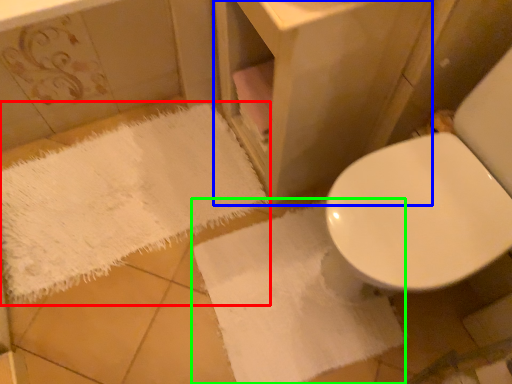
Question: Considering the real-world distances, which object is farthest from bath towel (highlighted by a red box)? vanity (highlighted by a blue box) or bath towel (highlighted by a green box)?

Choices:
 (A) vanity
 (B) bath towel

Answer: (A)